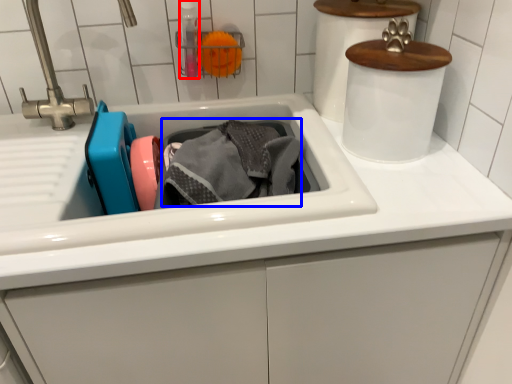
Question: Which point is closer to the camera, bottle (highlighted by a red box) or material (highlighted by a blue box)?

Choices:
 (A) bottle
 (B) material

Answer: (B)